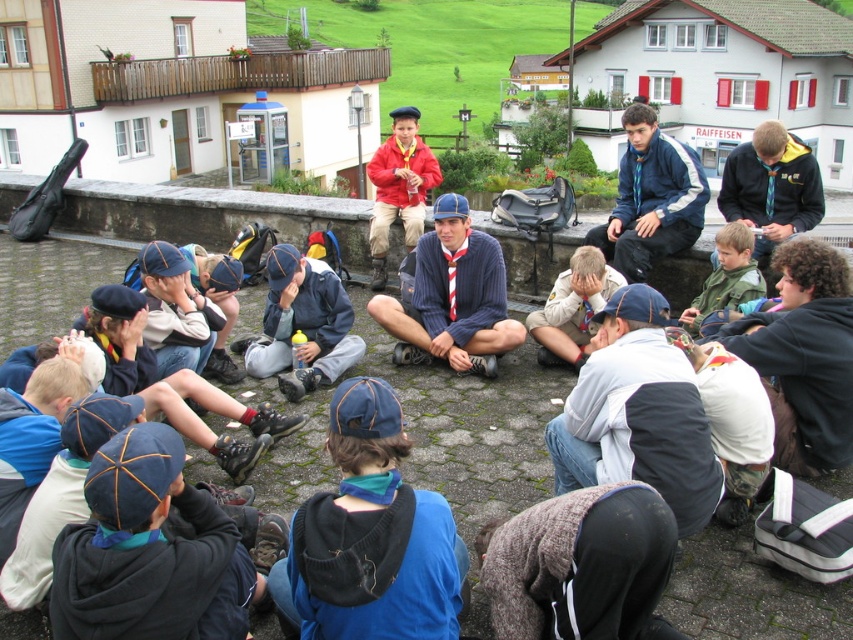
You are a scout leader standing at the camera position. You need to retrieve an item located at point (804, 266). Can you reach it without moving more than 15 feet from your current position?

The distance of point (804, 266) from camera is 16.31 feet, so you cannot reach it without moving more than 15 feet from your current position.

You are a scout leader trying to identify two scouts in the center of the image. You notice a matte red jacket at center and a light brown uniform at center. Which one is located to the left?

The matte red jacket at center is positioned on the left side of light brown uniform at center.

You are a scout in the group and want to move from point A to point B. Point A is at coordinate point (428, 355) and point B is at coordinate point (338, 280). Which point is closer to you, point A or point B?

Point A is closer to you because it is further to the viewer than point B.